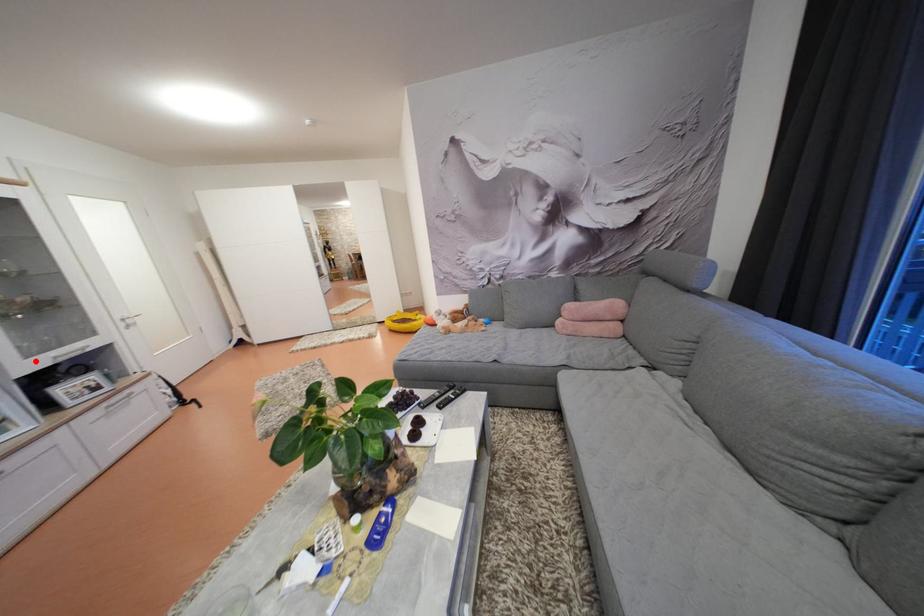
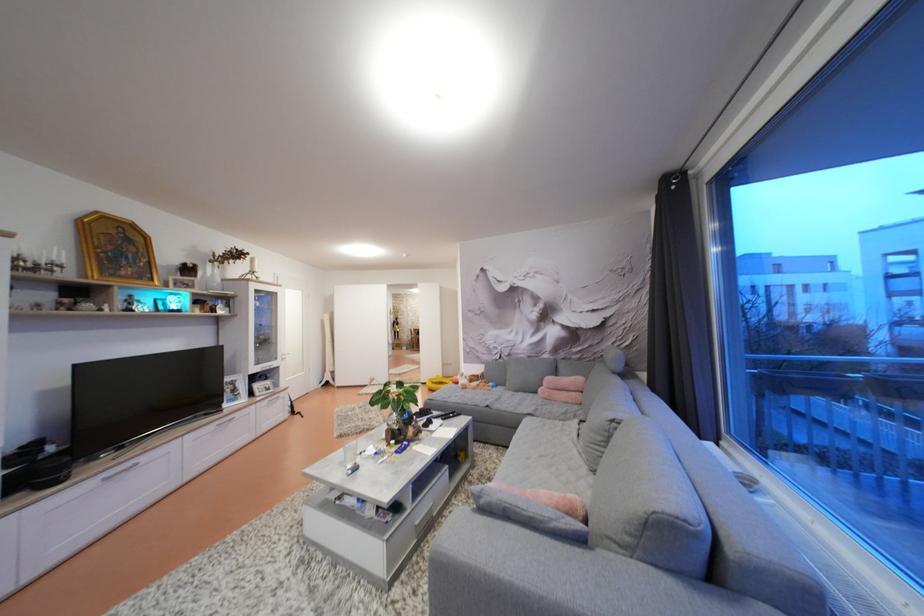
In the second image, find the point that corresponds to the highlighted location in the first image.

(263, 370)